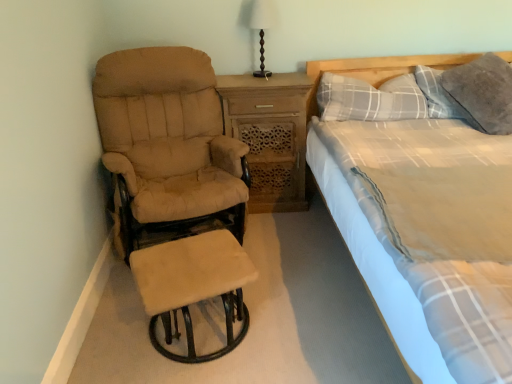
The height and width of the screenshot is (384, 512). I want to click on empty space that is in between beige fabric recliner at left and beige suede stool at lower left, so click(253, 301).